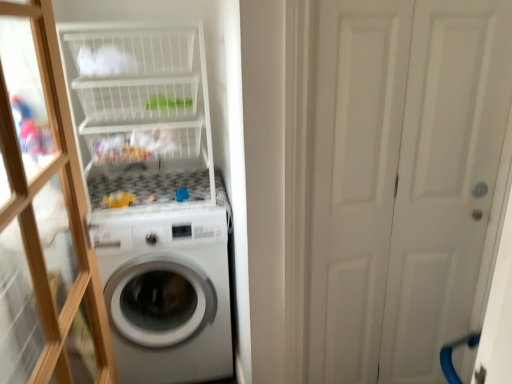
Question: Is point (423, 122) closer or farther from the camera than point (4, 19)?

Choices:
 (A) closer
 (B) farther

Answer: (A)

Question: From a real-world perspective, is white matte door at right above or below transparent glass door at left?

Choices:
 (A) below
 (B) above

Answer: (A)

Question: Which object is the farthest from the white matte door at right?

Choices:
 (A) transparent glass door at left
 (B) white wire basket at upper left
 (C) white glossy washing machine at center

Answer: (A)

Question: Which of these objects is positioned farthest from the transparent glass door at left?

Choices:
 (A) white wire basket at upper left
 (B) white matte door at right
 (C) white glossy washing machine at center

Answer: (B)